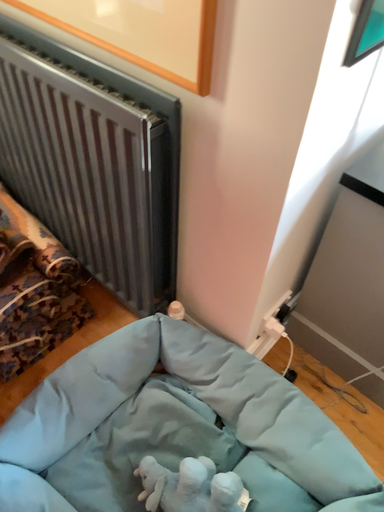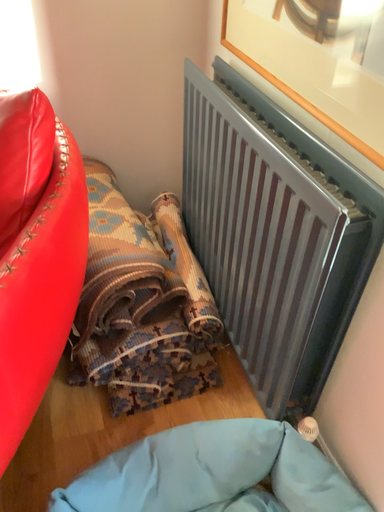
Question: Which way did the camera rotate in the video?

Choices:
 (A) rotated left
 (B) rotated right

Answer: (A)